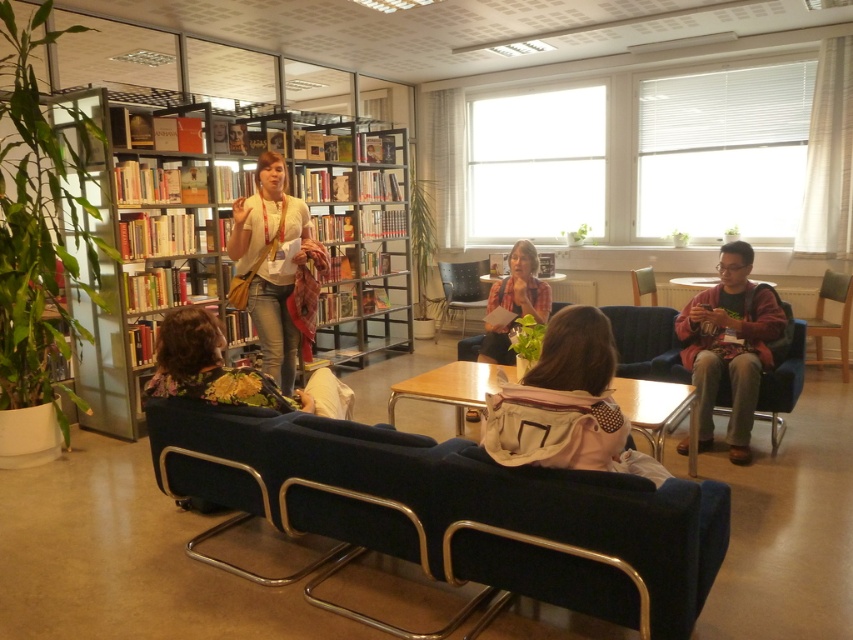
You are sitting on the velvet dark blue couch at center and want to reach the matte gold armchair at center. Which direction should you move to get there?

The velvet dark blue couch at center is positioned under the matte gold armchair at center, so you should move upward to reach it.

You are organizing a small event in the library and need to place a beige fabric backpack at center and a plaid shirt at center on a shelf. The shelf has limited height. Which item should you place first to ensure both fit without exceeding the shelf height?

The beige fabric backpack at center is not as tall as plaid shirt at center, so you should place the plaid shirt at center first to accommodate its greater height, then the backpack on top or below to fit within the shelf height.